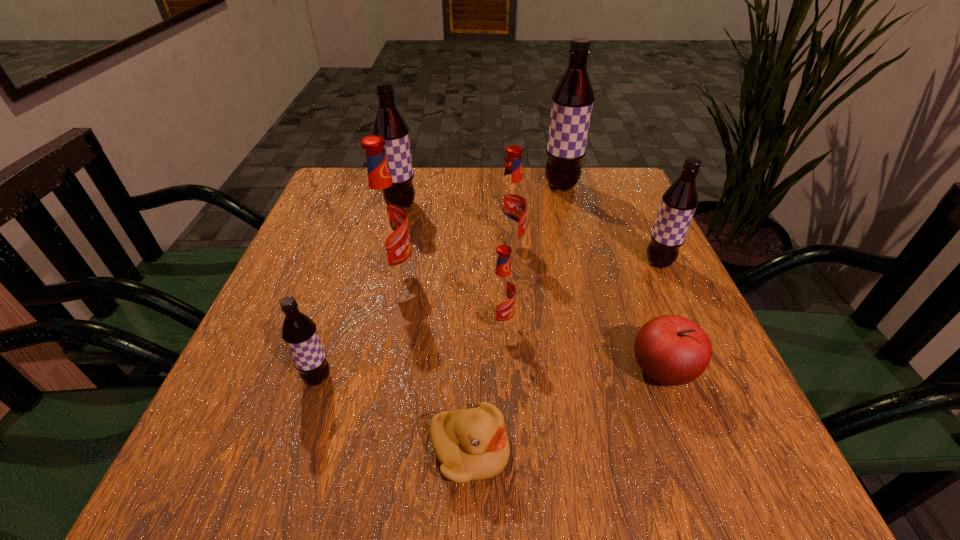
Locate an element on the screen. unoccupied position between the second nearest brown root beer and the duckling is located at coordinates (564, 357).

This screenshot has height=540, width=960. What are the coordinates of `unoccupied position between the red apple and the tallest object` in the screenshot? It's located at (612, 279).

The image size is (960, 540). Find the location of `free space between the leftmost brown root beer and the farthest brown root beer`. free space between the leftmost brown root beer and the farthest brown root beer is located at coordinates (440, 282).

I want to click on vacant area that lies between the second biggest red root beer and the second nearest red root beer, so click(x=452, y=261).

I want to click on empty location between the leftmost object and the second nearest root beer, so click(409, 351).

You are a GUI agent. You are given a task and a screenshot of the screen. Output one action in this format:
    pyautogui.click(x=<x>, y=<y>)
    Task: Click on the object that is the seventh closest to the nearest red root beer
    The image size is (960, 540).
    Given the screenshot: What is the action you would take?
    [389, 123]

Where is `object that is the closest one to the red apple`? The image size is (960, 540). object that is the closest one to the red apple is located at coordinates [x=502, y=289].

You are a GUI agent. You are given a task and a screenshot of the screen. Output one action in this format:
    pyautogui.click(x=<x>, y=<y>)
    Task: Click on the root beer object that ranks as the second closest to the leftmost red root beer
    Image resolution: width=960 pixels, height=540 pixels.
    Given the screenshot: What is the action you would take?
    pyautogui.click(x=511, y=203)

You are a GUI agent. You are given a task and a screenshot of the screen. Output one action in this format:
    pyautogui.click(x=<x>, y=<y>)
    Task: Click on the root beer identified as the sixth closest to the nearest object
    The image size is (960, 540).
    Given the screenshot: What is the action you would take?
    coord(389,123)

I want to click on the closest brown root beer to the smallest brown root beer, so click(389, 123).